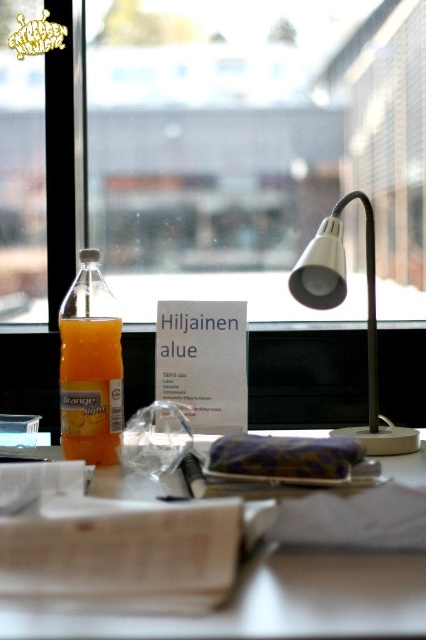
Question: Estimate the real-world distances between objects in this image. Which object is closer to the transparent glass window sill at center?

Choices:
 (A) white paper at center
 (B) white metallic desk lamp at center right
 (C) transparent glass window at center

Answer: (B)

Question: Does translucent glass bottle at left appear on the left side of transparent glass window sill at center?

Choices:
 (A) no
 (B) yes

Answer: (B)

Question: Does white paper at center have a lesser width compared to transparent glass window sill at center?

Choices:
 (A) no
 (B) yes

Answer: (B)

Question: Is transparent glass window at center to the left of transparent glass window sill at center from the viewer's perspective?

Choices:
 (A) yes
 (B) no

Answer: (B)

Question: Among these objects, which one is farthest from the camera?

Choices:
 (A) transparent glass window sill at center
 (B) white metallic desk lamp at center right
 (C) transparent glass window at center
 (D) translucent glass bottle at left

Answer: (C)

Question: Based on their relative distances, which object is farther from the transparent glass window sill at center?

Choices:
 (A) transparent glass window at center
 (B) translucent glass bottle at left

Answer: (B)